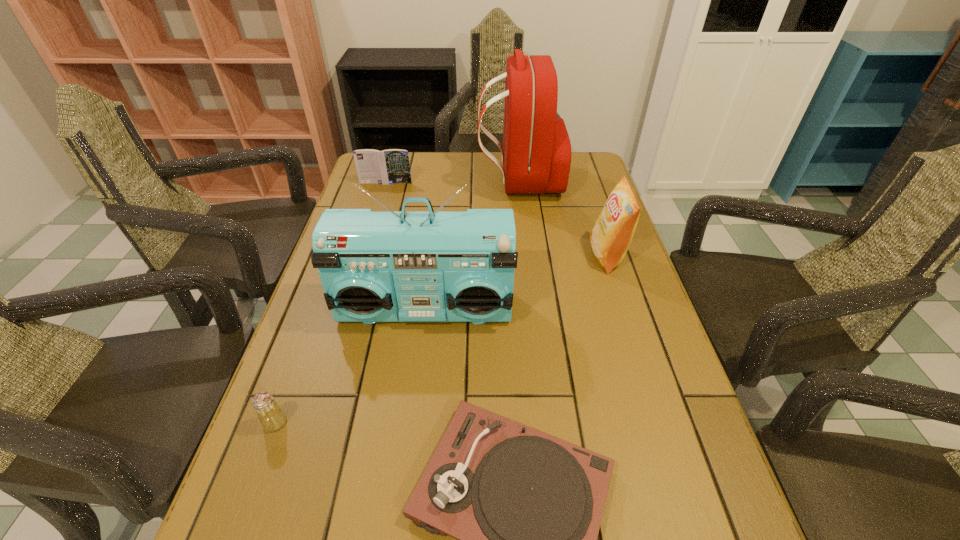
At what (x,y) coordinates should I click in order to perform the action: click on the tallest object. Please return your answer as a coordinate pair (x, y). This screenshot has height=540, width=960. Looking at the image, I should click on (536, 155).

I want to click on radio receiver, so click(429, 266).

Identify the location of the fifth shortest object. (429, 266).

This screenshot has width=960, height=540. What are the coordinates of `the third tallest object` in the screenshot? It's located at (610, 237).

The height and width of the screenshot is (540, 960). I want to click on the third farthest object, so click(x=610, y=237).

Locate an element on the screen. This screenshot has height=540, width=960. the third shortest object is located at coordinates (390, 166).

Locate an element on the screen. The width and height of the screenshot is (960, 540). saltshaker is located at coordinates (271, 416).

I want to click on free space located on the strap side of the tallest object, so click(x=460, y=181).

Locate an element on the screen. vacant region located on the strap side of the tallest object is located at coordinates (463, 181).

This screenshot has width=960, height=540. Find the location of `free space located on the strap side of the tallest object`. free space located on the strap side of the tallest object is located at coordinates (394, 181).